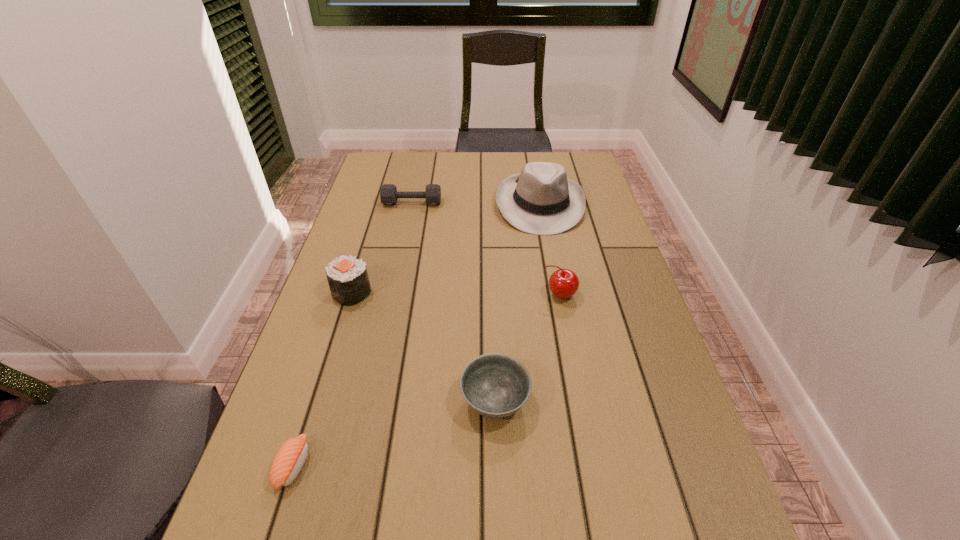
Locate an element on the screen. The width and height of the screenshot is (960, 540). free space located on the back of the bowl is located at coordinates (492, 296).

Locate an element on the screen. The image size is (960, 540). vacant space located 0.190m on the right of the dumbbell is located at coordinates (497, 203).

In order to click on vacant space situated on the back of the shortest object in this screenshot , I will do `click(319, 386)`.

This screenshot has width=960, height=540. What are the coordinates of `object that is at the far edge` in the screenshot? It's located at (541, 200).

The width and height of the screenshot is (960, 540). I want to click on dumbbell that is at the left edge, so 388,192.

The image size is (960, 540). What are the coordinates of `object present at the right edge` in the screenshot? It's located at (541, 200).

The image size is (960, 540). I want to click on object that is at the far right corner, so click(541, 200).

In the image, there is a desktop. At what (x,y) coordinates should I click in order to perform the action: click on vacant space at the far edge. Please return your answer as a coordinate pair (x, y). Looking at the image, I should click on (445, 160).

The height and width of the screenshot is (540, 960). Identify the location of vacant area at the left edge of the desktop. pyautogui.click(x=292, y=363).

Identify the location of free point at the right edge. (629, 343).